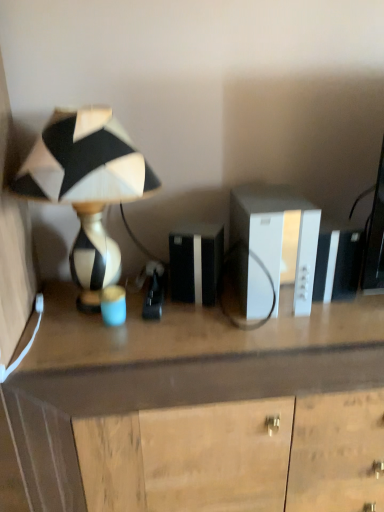
Measure the distance between wooden desk at center and camera.

wooden desk at center is 92.22 centimeters away from camera.

What is the approximate height of wooden desk at center?

It is 32.15 inches.

This screenshot has height=512, width=384. I want to click on white plastic cabinet at center, so click(277, 234).

The height and width of the screenshot is (512, 384). What do you see at coordinates (277, 234) in the screenshot?
I see `white plastic cabinet at center` at bounding box center [277, 234].

Find the location of a particular element. wooden desk at center is located at coordinates (174, 398).

In the scene shown: Would you say white plastic cabinet at center is a long distance from black and white ceramic lamp at left?

No, white plastic cabinet at center is not far away from black and white ceramic lamp at left.

Is white plastic cabinet at center inside or outside of black and white ceramic lamp at left?

white plastic cabinet at center is outside black and white ceramic lamp at left.

I want to click on cabinetry lying behind the black and white ceramic lamp at left, so click(277, 234).

From the image's perspective, does white plastic cabinet at center appear higher than black and white ceramic lamp at left?

No.

Is wooden desk at center at the right side of black and white ceramic lamp at left?

Yes.

Based on the photo, measure the distance from wooden desk at center to black and white ceramic lamp at left.

14.55 inches.

From the image's perspective, which object appears higher, wooden desk at center or black and white ceramic lamp at left?

From the image's view, black and white ceramic lamp at left is above.

Is point (245, 443) more distant than point (97, 273)?

No, (245, 443) is closer to viewer.

Which is more distant, (x=116, y=184) or (x=285, y=480)?

Point (x=285, y=480)

Is black and white ceramic lamp at left positioned with its back to wooden desk at center?

black and white ceramic lamp at left is not turned away from wooden desk at center.

From their relative heights in the image, would you say black and white ceramic lamp at left is taller or shorter than wooden desk at center?

Considering their sizes, black and white ceramic lamp at left has less height than wooden desk at center.

From a real-world perspective, does black and white ceramic lamp at left stand above wooden desk at center?

Yes.

Is white plastic cabinet at center wider or thinner than wooden desk at center?

In the image, white plastic cabinet at center appears to be more narrow than wooden desk at center.

From the image's perspective, between white plastic cabinet at center and wooden desk at center, who is located below?

wooden desk at center appears lower in the image.

Find the location of a particular element. The width and height of the screenshot is (384, 512). cabinetry behind the wooden desk at center is located at coordinates (277, 234).

Between white plastic cabinet at center and wooden desk at center, which one has smaller size?

With smaller size is white plastic cabinet at center.

Is wooden desk at center outside of white plastic cabinet at center?

wooden desk at center lies outside white plastic cabinet at center's area.

From a real-world perspective, is wooden desk at center on top of white plastic cabinet at center?

No.

Is wooden desk at center turned away from white plastic cabinet at center?

wooden desk at center does not have its back to white plastic cabinet at center.

Who is smaller, black and white ceramic lamp at left or white plastic cabinet at center?

white plastic cabinet at center.

Considering the relative sizes of black and white ceramic lamp at left and white plastic cabinet at center in the image provided, is black and white ceramic lamp at left wider than white plastic cabinet at center?

No, black and white ceramic lamp at left is not wider than white plastic cabinet at center.

Between point (35, 169) and point (301, 292), which one is positioned in front?

Positioned in front is point (35, 169).

I want to click on cabinetry below the black and white ceramic lamp at left (from the image's perspective), so click(x=277, y=234).

This screenshot has width=384, height=512. Find the location of `cabinetry below the black and white ceramic lamp at left (from a real-world perspective)`. cabinetry below the black and white ceramic lamp at left (from a real-world perspective) is located at coordinates (277, 234).

The width and height of the screenshot is (384, 512). What are the coordinates of `lamp above the wooden desk at center (from a real-world perspective)` in the screenshot? It's located at (87, 188).

From the image, which object appears to be farther from black and white ceramic lamp at left, white plastic cabinet at center or wooden desk at center?

white plastic cabinet at center lies further to black and white ceramic lamp at left than the other object.

Which object lies nearer to the anchor point black and white ceramic lamp at left, wooden desk at center or white plastic cabinet at center?

wooden desk at center.

From the picture: Which object lies nearer to the anchor point wooden desk at center, white plastic cabinet at center or black and white ceramic lamp at left?

white plastic cabinet at center is positioned closer to the anchor wooden desk at center.

Based on their spatial positions, is black and white ceramic lamp at left or white plastic cabinet at center closer to wooden desk at center?

The object closer to wooden desk at center is white plastic cabinet at center.

When comparing their distances from white plastic cabinet at center, does black and white ceramic lamp at left or wooden desk at center seem closer?

wooden desk at center.

Considering their positions, is wooden desk at center positioned closer to white plastic cabinet at center than black and white ceramic lamp at left?

Based on the image, wooden desk at center appears to be nearer to white plastic cabinet at center.

The image size is (384, 512). In order to click on cabinetry that lies between black and white ceramic lamp at left and wooden desk at center from top to bottom in this screenshot , I will do `click(277, 234)`.